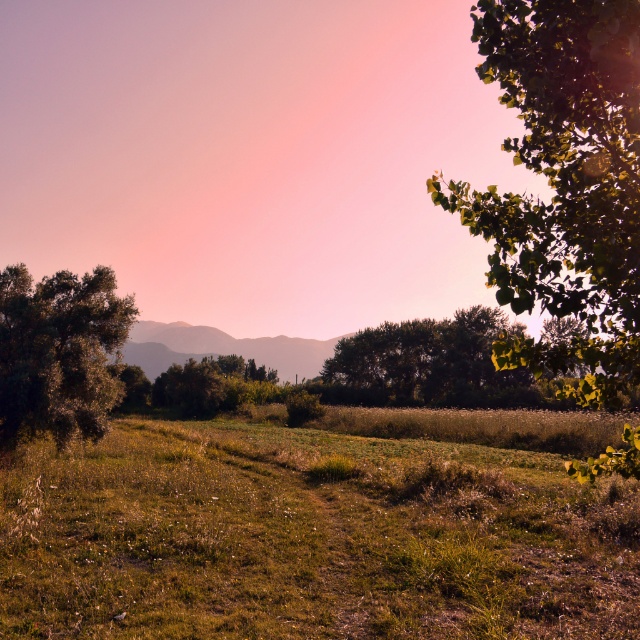
From the picture: You are a hiker standing on the dirt path in the center of the field. You want to take a photo of both the green leafy tree at left and the green leafy tree at center in the same frame. Which tree should you move closer to in order to include both trees fully in your photo?

To include both the green leafy tree at left and the green leafy tree at center in the same frame, you should move closer to the green leafy tree at center. Since the tree at the center is taller than the one at the left, moving closer to the taller tree allows you to capture its full height while still framing the shorter tree in the background.

Based on the coordinates provided, can you determine the exact position of the green grassy field at center in the image?

The green grassy field at center is located at the coordinates point (308, 538).

You are an environmental scientist studying tree growth in rural areas. You observe the green leafy tree at left and the green leafy tree at center in the image. Which tree would you recommend for a study on growth potential, and why?

The green leafy tree at center is larger than the green leafy tree at left, indicating greater growth potential. Therefore, the green leafy tree at center would be the better choice for studying growth potential.